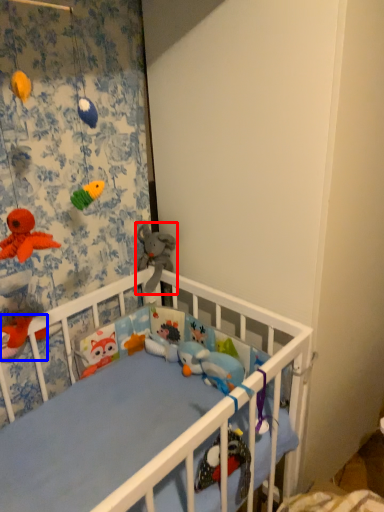
Question: Among these objects, which one is farthest to the camera, toy (highlighted by a red box) or toy (highlighted by a blue box)?

Choices:
 (A) toy
 (B) toy

Answer: (A)